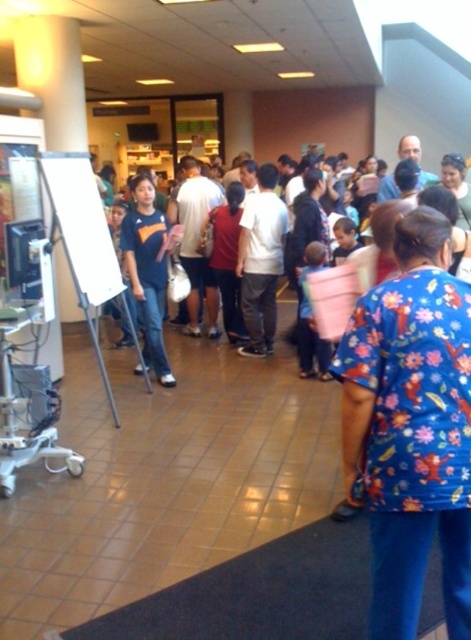
Does floral print scrubs at center have a larger size compared to matte blue shirt at center?

Actually, floral print scrubs at center might be smaller than matte blue shirt at center.

Which is behind, point (362, 468) or point (168, 241)?

The point (168, 241) is more distant.

Locate an element on the screen. Image resolution: width=471 pixels, height=640 pixels. floral print scrubs at center is located at coordinates (411, 426).